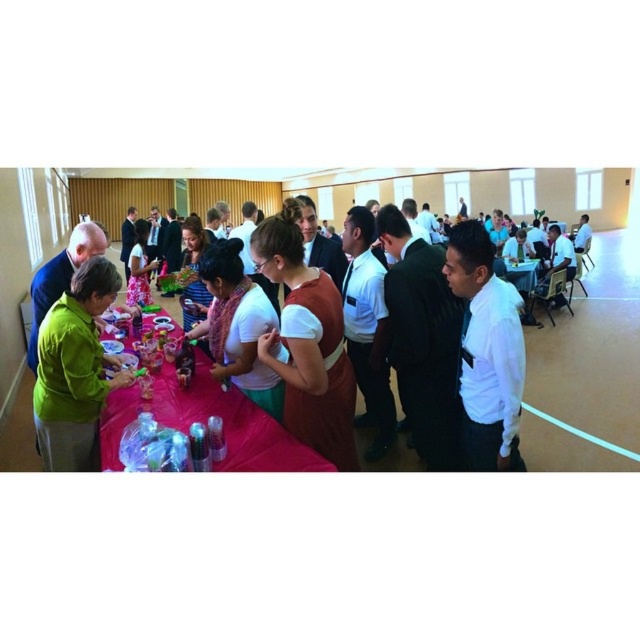
You are at the event and want to greet the person in the green matte shirt at lower left. To reach them, you need to walk around the long table with the red tablecloth. Which direction should you walk from your current position at the white shirt at center?

The white shirt at center is positioned on the right side of the green matte shirt at lower left. To reach the green matte shirt at lower left, you should walk to the left from the white shirt at center.

Based on the photo, you are standing at the entrance of the hall and want to greet both the person wearing the white shirt at center and the person in the green matte shirt at lower left. Which person should you approach first if you want to minimize the distance walked?

The white shirt at center is closer to the entrance than the green matte shirt at lower left, so you should approach the white shirt at center first to minimize the distance walked.

You are a guest at the event and want to place your green matte jacket at left on the green fabric tablecloth at left. Will the jacket fit entirely on the tablecloth without hanging off the edges?

The green fabric tablecloth at left has a greater height compared to the green matte jacket at left, so the jacket will fit entirely on the tablecloth without hanging off the edges.